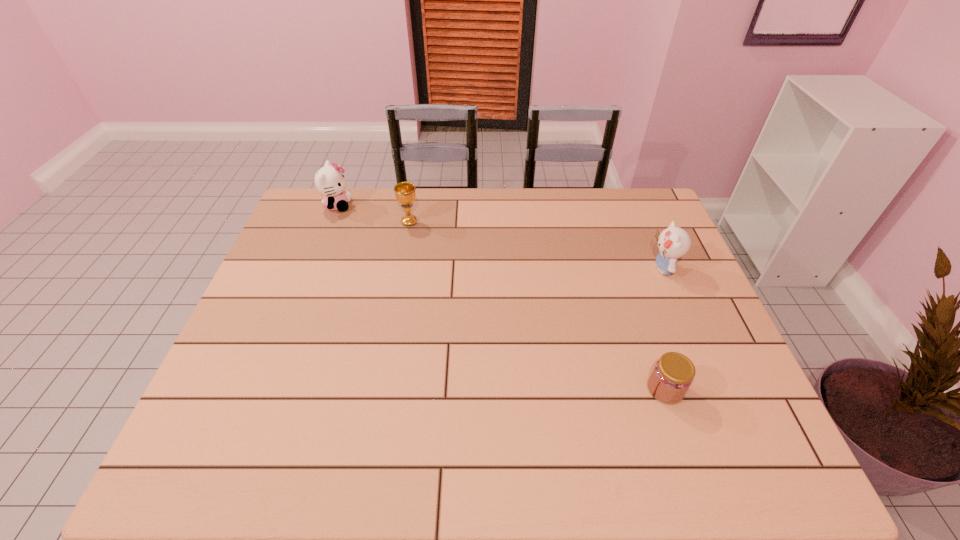
Locate an element on the screen. This screenshot has width=960, height=540. free region at the near edge is located at coordinates (272, 441).

Find the location of a particular element. free region at the left edge of the desktop is located at coordinates (262, 407).

Image resolution: width=960 pixels, height=540 pixels. I want to click on vacant space at the right edge, so pos(660,285).

I want to click on free space at the far left corner of the desktop, so click(355, 190).

This screenshot has width=960, height=540. Find the location of `vacant area between the leftmost object and the second object from left to right`. vacant area between the leftmost object and the second object from left to right is located at coordinates (373, 214).

This screenshot has width=960, height=540. In order to click on vacant region between the leftmost object and the chalice in this screenshot , I will do tap(373, 214).

Image resolution: width=960 pixels, height=540 pixels. What are the coordinates of `empty space that is in between the chalice and the leftmost object` in the screenshot? It's located at (373, 214).

This screenshot has width=960, height=540. Identify the location of vacant area that lies between the third object from right to left and the left kitten. (373, 214).

Find the location of a particular element. The image size is (960, 540). empty space that is in between the leftmost object and the jam is located at coordinates (501, 297).

Where is `blank region between the shortest object and the rightmost object`? The height and width of the screenshot is (540, 960). blank region between the shortest object and the rightmost object is located at coordinates (664, 329).